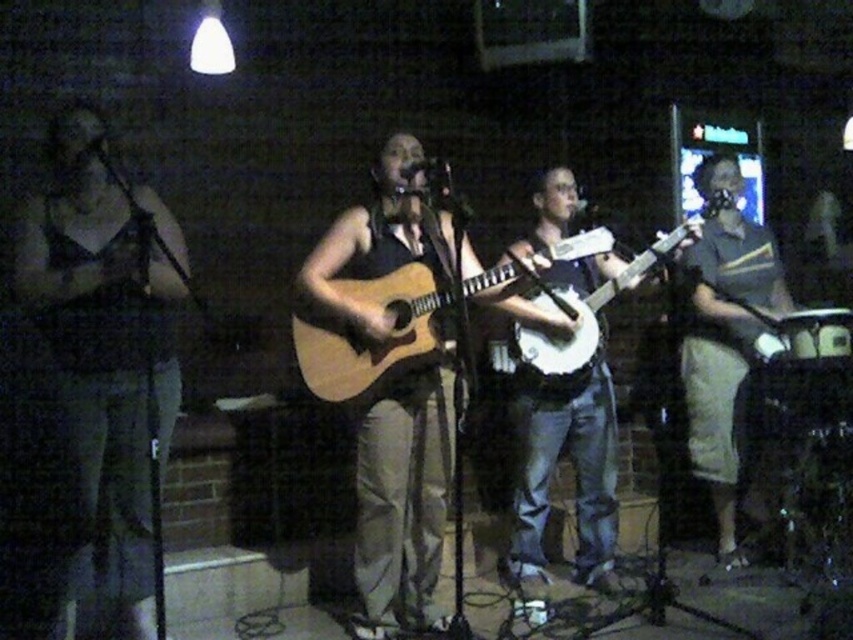
Who is lower down, matte black tank top at left or light brown acoustic guitar at center?

matte black tank top at left

Does matte black tank top at left have a greater width compared to light brown acoustic guitar at center?

In fact, matte black tank top at left might be narrower than light brown acoustic guitar at center.

Find the location of a particular element. matte black tank top at left is located at coordinates (106, 356).

Which is more to the right, beige fabric skirt at right or light brown acoustic guitar at center?

beige fabric skirt at right is more to the right.

Does beige fabric skirt at right come in front of light brown acoustic guitar at center?

No.

Describe the element at coordinates (724, 336) in the screenshot. I see `beige fabric skirt at right` at that location.

Locate an element on the screen. This screenshot has height=640, width=853. beige fabric skirt at right is located at coordinates (724, 336).

Does matte black banjo at center have a larger size compared to beige fabric skirt at right?

Actually, matte black banjo at center might be smaller than beige fabric skirt at right.

Does point (521, 513) lie in front of point (776, 314)?

Yes, it is in front of point (776, 314).

Image resolution: width=853 pixels, height=640 pixels. I want to click on matte black banjo at center, so click(573, 470).